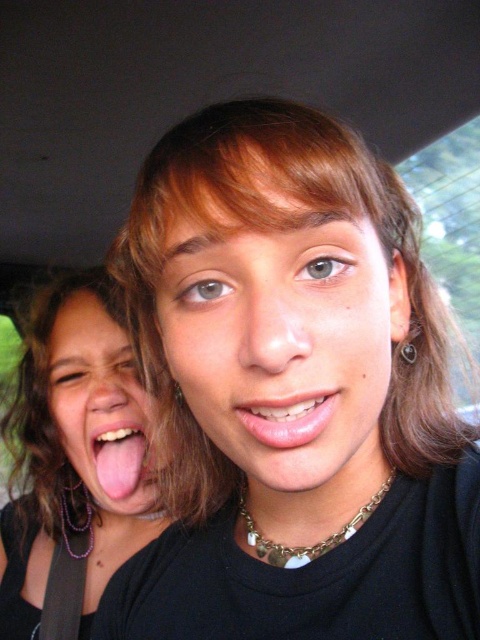
Question: Estimate the real-world distances between objects in this image. Which object is closer to the pink glossy lips at center?

Choices:
 (A) smooth skin face at center
 (B) matte black hair at center
 (C) pink glossy tongue at lower left

Answer: (A)

Question: Is matte black hair at left smaller than pink glossy lips at center?

Choices:
 (A) yes
 (B) no

Answer: (B)

Question: Which point appears farthest from the camera in this image?

Choices:
 (A) (259, 438)
 (B) (118, 426)
 (C) (60, 572)

Answer: (C)

Question: Observing the image, what is the correct spatial positioning of smooth skin face at center in reference to pink glossy lips at center?

Choices:
 (A) left
 (B) right

Answer: (B)

Question: Considering the relative positions of smooth skin face at center and pink glossy tongue at lower left in the image provided, where is smooth skin face at center located with respect to pink glossy tongue at lower left?

Choices:
 (A) above
 (B) below

Answer: (A)

Question: Which object is farther from the camera taking this photo?

Choices:
 (A) matte black hair at center
 (B) smooth skin face at center
 (C) matte black hair at left
 (D) pink glossy tongue at lower left

Answer: (D)